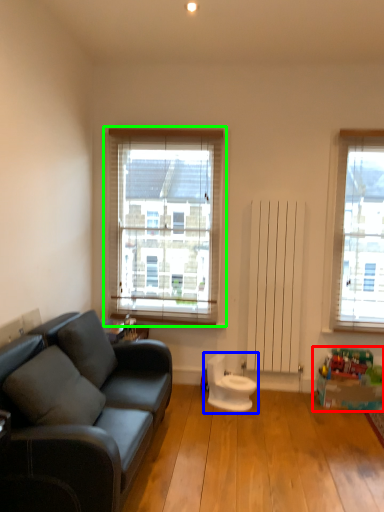
Question: Which object is the farthest from toy (highlighted by a red box)? Choose among these: swivel chair (highlighted by a blue box) or window (highlighted by a green box).

Choices:
 (A) swivel chair
 (B) window

Answer: (B)